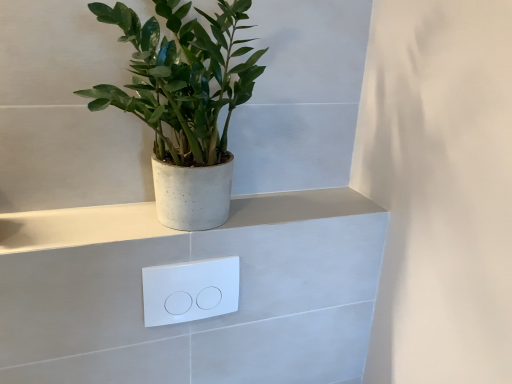
The image size is (512, 384). What are the coordinates of `empty space that is ontop of white concrete ledge at upper center` in the screenshot? It's located at (143, 218).